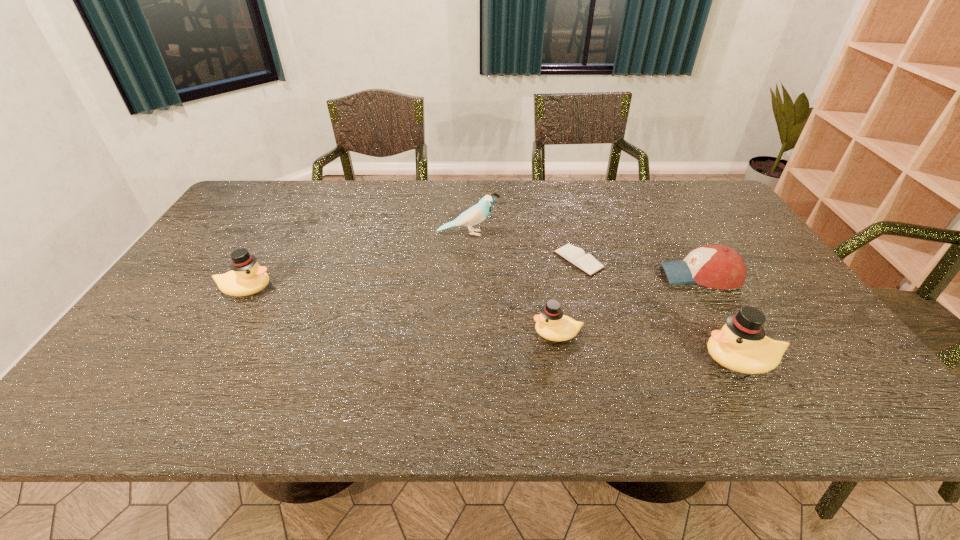
If equal spacing is desired by inserting an extra duck among them, please point out a free spot for this new duck. Please provide its 2D coordinates. Your answer should be formatted as a tuple, i.e. [(x, y)], where the tuple contains the x and y coordinates of a point satisfying the conditions above.

[(394, 310)]